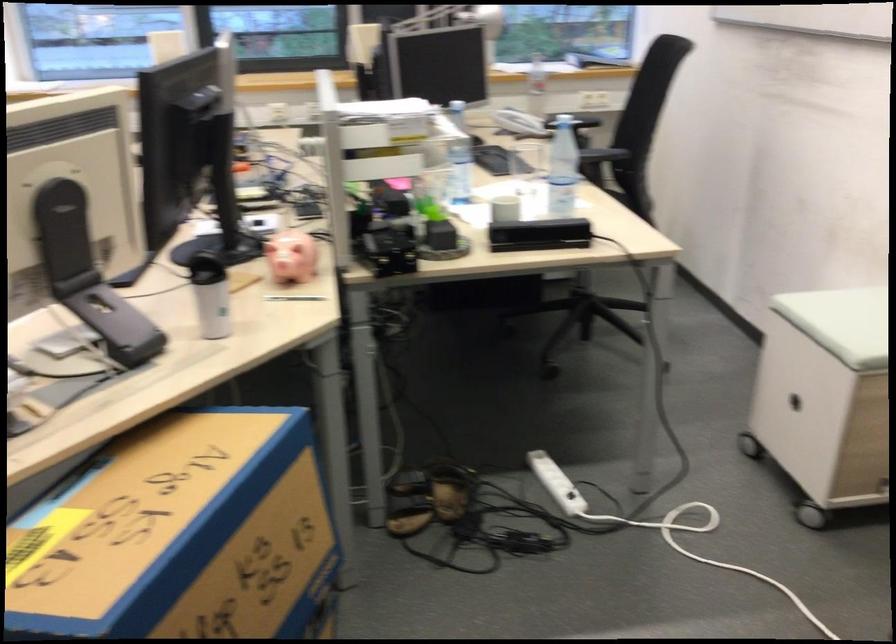
Image resolution: width=896 pixels, height=644 pixels. What do you see at coordinates (574, 120) in the screenshot?
I see `the black chair armrest` at bounding box center [574, 120].